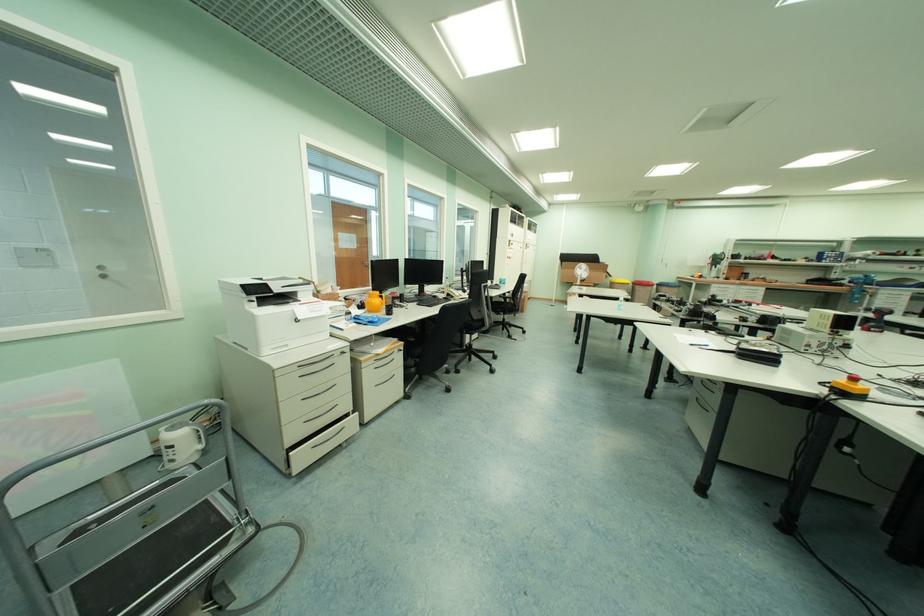
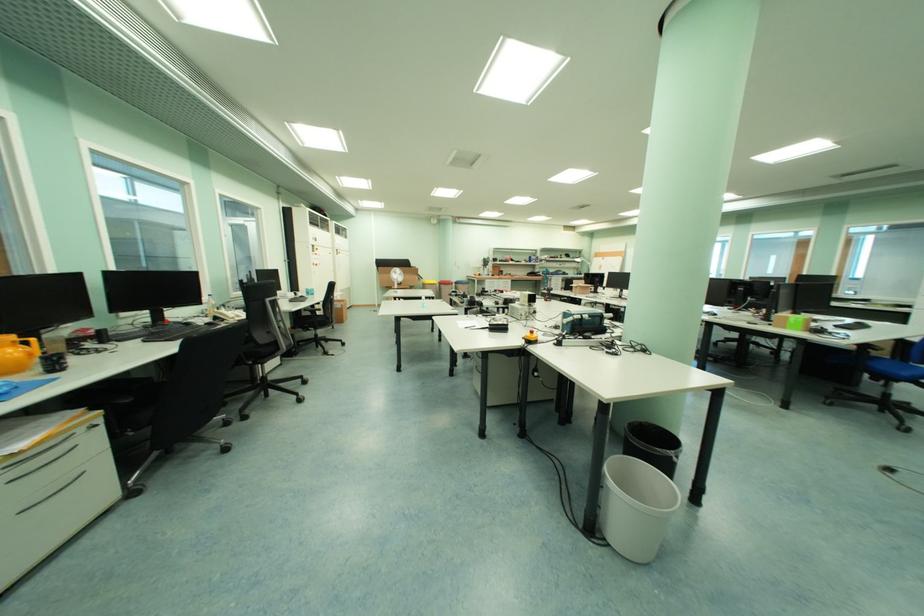
Question: Based on the continuous images, in which direction is the camera rotating? Reply with the corresponding letter.

Choices:
 (A) Left
 (B) Right
 (C) Up
 (D) Down

Answer: (B)